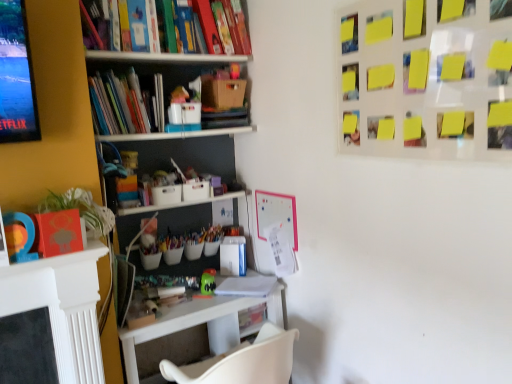
Question: From a real-world perspective, is green leafy plant at left below yellow sticky notes at upper right?

Choices:
 (A) yes
 (B) no

Answer: (A)

Question: Is there a large distance between green leafy plant at left and yellow sticky notes at upper right?

Choices:
 (A) no
 (B) yes

Answer: (B)

Question: Is green leafy plant at left at the left side of yellow sticky notes at upper right?

Choices:
 (A) yes
 (B) no

Answer: (A)

Question: Considering the relative sizes of green leafy plant at left and yellow sticky notes at upper right in the image provided, is green leafy plant at left bigger than yellow sticky notes at upper right?

Choices:
 (A) yes
 (B) no

Answer: (B)

Question: Is green leafy plant at left placed right next to yellow sticky notes at upper right?

Choices:
 (A) yes
 (B) no

Answer: (B)

Question: Is green leafy plant at left positioned with its back to yellow sticky notes at upper right?

Choices:
 (A) yes
 (B) no

Answer: (B)

Question: Can we say yellow sticky notes at upper right lies outside white plastic table at lower left?

Choices:
 (A) no
 (B) yes

Answer: (B)

Question: From a real-world perspective, is yellow sticky notes at upper right below white plastic table at lower left?

Choices:
 (A) no
 (B) yes

Answer: (A)

Question: From the image's perspective, is yellow sticky notes at upper right located beneath white plastic table at lower left?

Choices:
 (A) yes
 (B) no

Answer: (B)

Question: From a real-world perspective, does yellow sticky notes at upper right stand above white plastic table at lower left?

Choices:
 (A) yes
 (B) no

Answer: (A)

Question: Can you confirm if yellow sticky notes at upper right is shorter than white plastic table at lower left?

Choices:
 (A) yes
 (B) no

Answer: (B)

Question: Is the position of yellow sticky notes at upper right less distant than that of white plastic table at lower left?

Choices:
 (A) no
 (B) yes

Answer: (B)

Question: Is the position of hardcover books at left more distant than that of brown cardboard box at upper center?

Choices:
 (A) no
 (B) yes

Answer: (A)